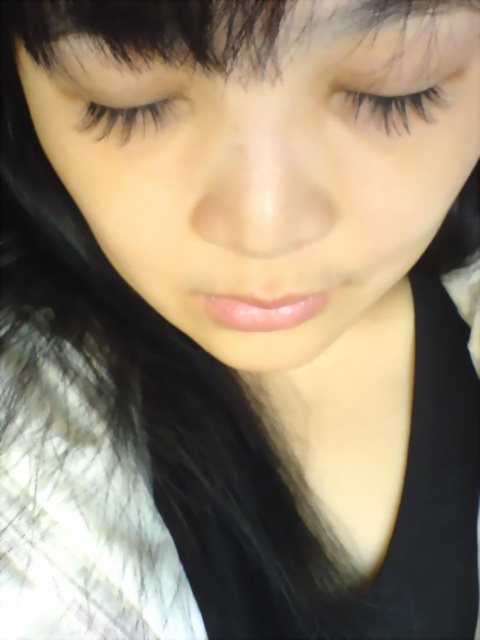
Question: Does smooth skin face at center appear on the left side of black eyelashes at upper left?

Choices:
 (A) no
 (B) yes

Answer: (A)

Question: Is smooth skin face at center closer to the viewer compared to black matte hair at upper center?

Choices:
 (A) no
 (B) yes

Answer: (A)

Question: Does smooth skin face at center have a greater width compared to black matte hair at upper center?

Choices:
 (A) yes
 (B) no

Answer: (A)

Question: Which object is farther from the camera taking this photo?

Choices:
 (A) black matte hair at upper center
 (B) black eyelashes at upper center

Answer: (B)

Question: Which object appears farthest from the camera in this image?

Choices:
 (A) smooth skin face at center
 (B) black matte hair at upper center
 (C) black eyelashes at upper left

Answer: (C)

Question: Which of the following is the closest to the observer?

Choices:
 (A) (384, 125)
 (B) (169, 115)
 (C) (335, 20)

Answer: (C)